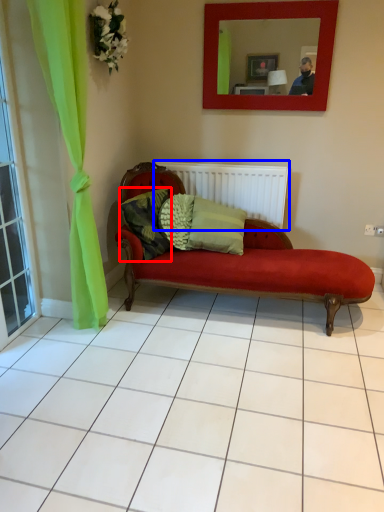
Question: Which point is closer to the camera, pillow (highlighted by a red box) or radiator (highlighted by a blue box)?

Choices:
 (A) pillow
 (B) radiator

Answer: (A)